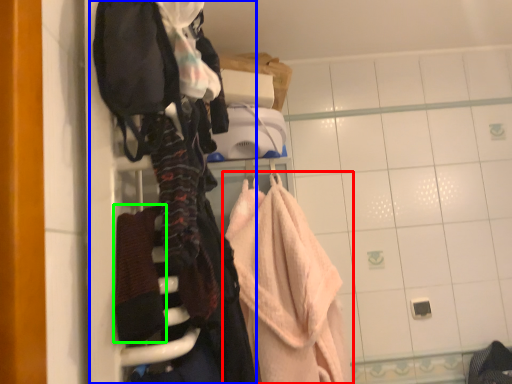
Question: Which is farther away from towel (highlighted by a red box)? closet (highlighted by a blue box) or bath towel (highlighted by a green box)?

Choices:
 (A) closet
 (B) bath towel

Answer: (B)